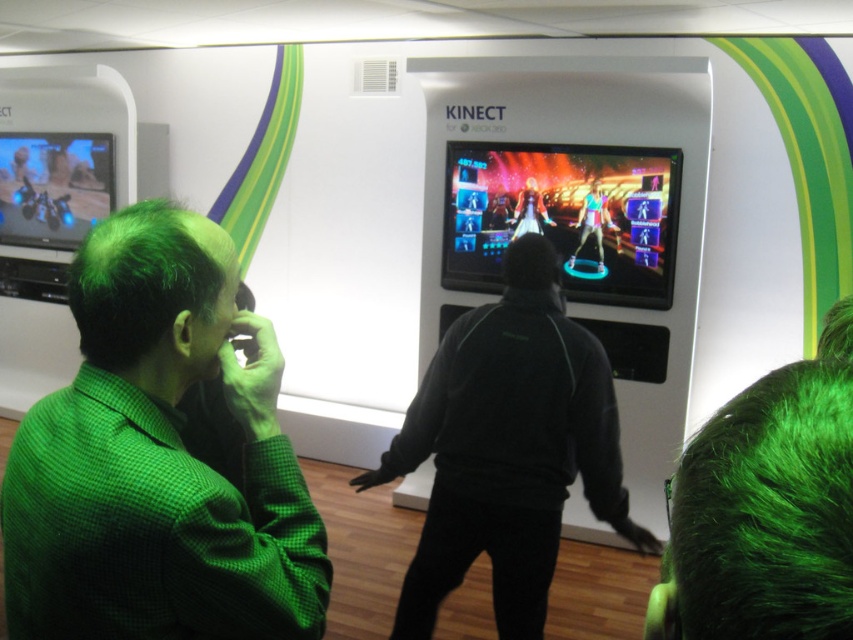
Question: Which object is the farthest from the matte white figure at center?

Choices:
 (A) shiny silver figure at center
 (B) green checkered shirt at left
 (C) black matte jacket at center

Answer: (B)

Question: Considering the real-world distances, which object is farthest from the shiny silver figure at center?

Choices:
 (A) shiny plastic screen at center
 (B) green checkered shirt at left
 (C) black matte jacket at center

Answer: (B)

Question: Is green checkered shirt at left closer to camera compared to black matte jacket at center?

Choices:
 (A) yes
 (B) no

Answer: (A)

Question: Is black matte jacket at center wider than metallic blue motorcycle at left?

Choices:
 (A) yes
 (B) no

Answer: (B)

Question: Which object is positioned farthest from the matte white figure at center?

Choices:
 (A) green checkered shirt at left
 (B) shiny plastic screen at center
 (C) black matte jacket at center
 (D) shiny silver figure at center

Answer: (A)

Question: Can you confirm if black matte jacket at center is positioned below shiny silver figure at center?

Choices:
 (A) yes
 (B) no

Answer: (A)